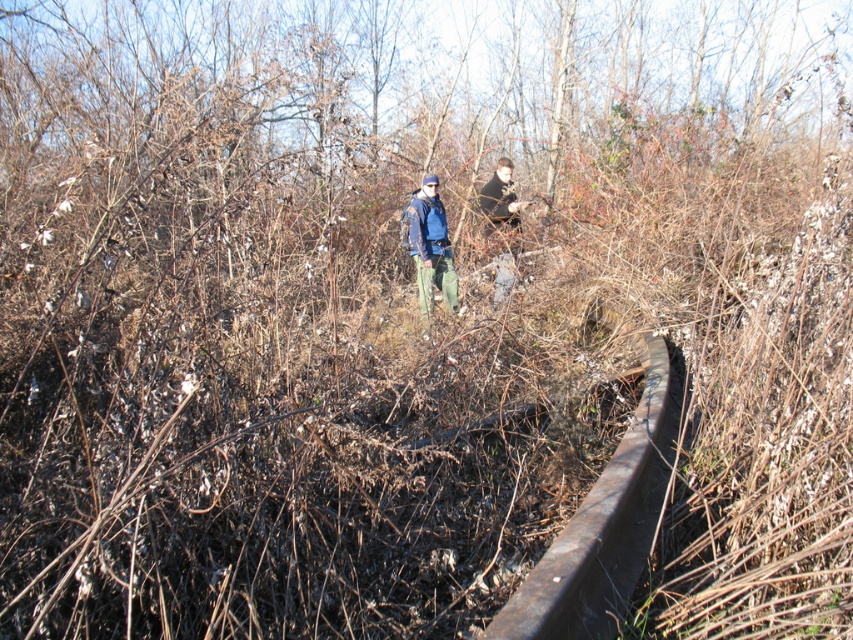
Which is in front, point (631, 461) or point (431, 216)?

Point (631, 461) is in front.

Which is above, rusty metal rail at center or blue denim jacket at center?

blue denim jacket at center is above.

Identify the location of rusty metal rail at center. This screenshot has width=853, height=640. (604, 525).

Is point (606, 564) in front of point (514, 248)?

Yes, it is.

Between rusty metal rail at center and dark blue jacket at center, which one has less height?

rusty metal rail at center is shorter.

Where is `rusty metal rail at center`? The image size is (853, 640). rusty metal rail at center is located at coordinates (604, 525).

I want to click on rusty metal rail at center, so coord(604,525).

Between blue denim jacket at center and dark blue jacket at center, which one is positioned higher?

dark blue jacket at center

Can you confirm if blue denim jacket at center is thinner than dark blue jacket at center?

No, blue denim jacket at center is not thinner than dark blue jacket at center.

The width and height of the screenshot is (853, 640). Describe the element at coordinates (430, 246) in the screenshot. I see `blue denim jacket at center` at that location.

Where is `blue denim jacket at center`? The width and height of the screenshot is (853, 640). blue denim jacket at center is located at coordinates (430, 246).